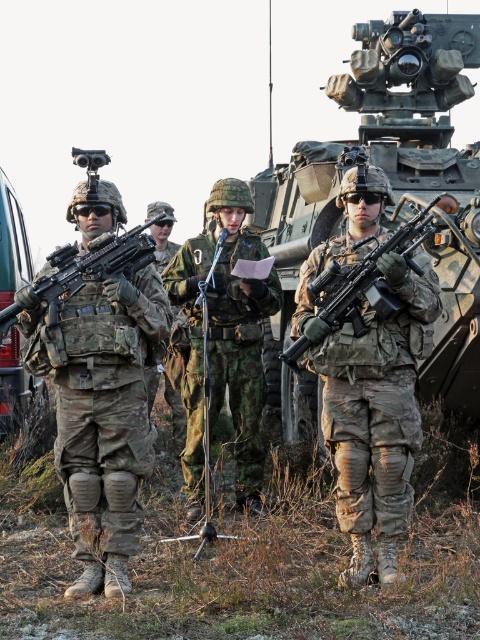
What is the location of the point labeled as point (369, 378) in the image?

The point labeled as point (369, 378) is on the camouflage fabric rifle at center.

You are a drone operator trying to locate the camouflage textured tank at center. According to the coordinates provided, where should you direct your drone to find it?

The camouflage textured tank at center is located at the 2D coordinates point [395,179].